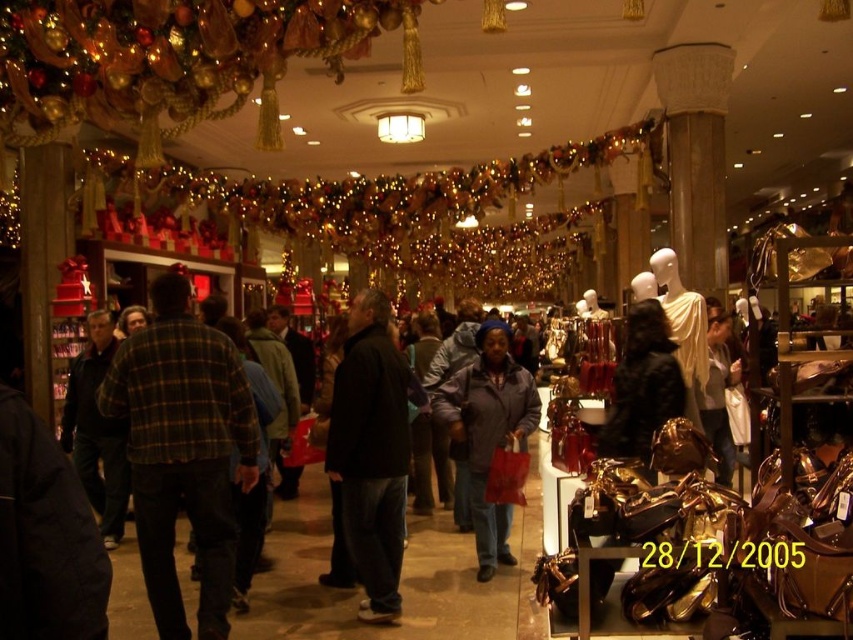
Consider the image. You are a customer in the store and want to hang a hanger on the wall between the plaid flannel shirt at center and the black matte jacket at center. The hanger is 1 meter tall. Can the space between them accommodate the hanger vertically?

The plaid flannel shirt at center has a lesser height compared to black matte jacket at center. Since the plaid flannel shirt is shorter, the vertical space between them may not be sufficient for a 1 meter tall hanger. Check the actual height difference to confirm.

You are a customer in the store and want to buy a jacket. You see the black matte jacket at center and the dark gray matte jacket at center. Which one is positioned to the left?

The black matte jacket at center is positioned to the left of the dark gray matte jacket at center.